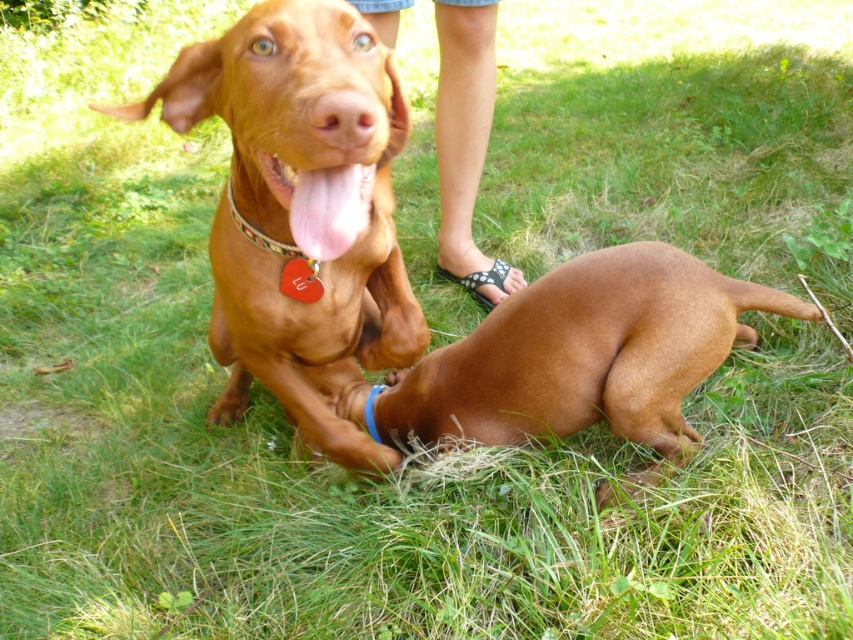
You are a dog owner who wants to ensure the safety of both dogs in the scene. Given that the blue rubber band at center is a chew toy, can the shiny brown dog at center safely play with it without causing any harm?

The shiny brown dog at center is larger in size than the blue rubber band at center. Since the blue rubber band at center is a small chew toy, there is a risk that the shiny brown dog at center might swallow it whole, posing a choking hazard. It is advisable to choose a larger toy suitable for its size to ensure safety.

You are a photographer trying to capture a closeup of the smooth tan skin at center and the pink glossy tongue at center. Which object should you focus on first if you want to ensure both are in focus?

The smooth tan skin at center should be focused on first because the pink glossy tongue at center is behind it, so adjusting focus from the front to the back will help both be in focus.